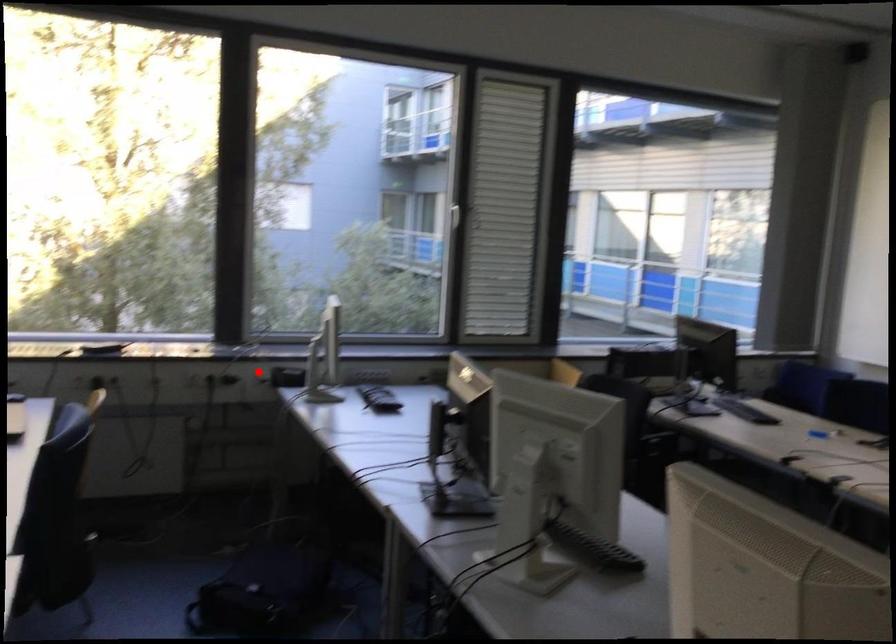
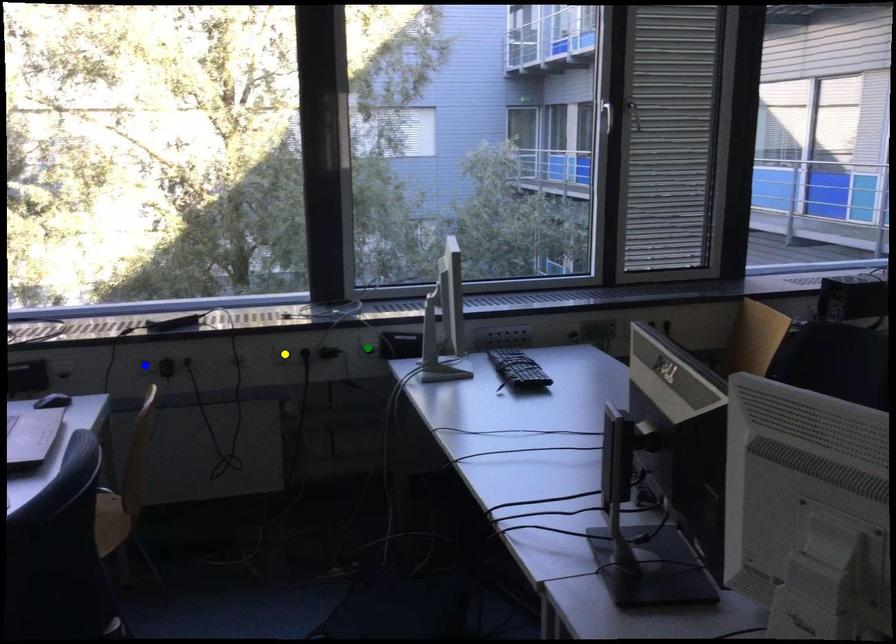
Question: I am providing you with two images of the same scene from different viewpoints. A red point is marked on the first image. You are given multiple points on the second image. Which point in image 2 represents the same 3d spot as the red point in image 1?

Choices:
 (A) green point
 (B) blue point
 (C) yellow point

Answer: (A)